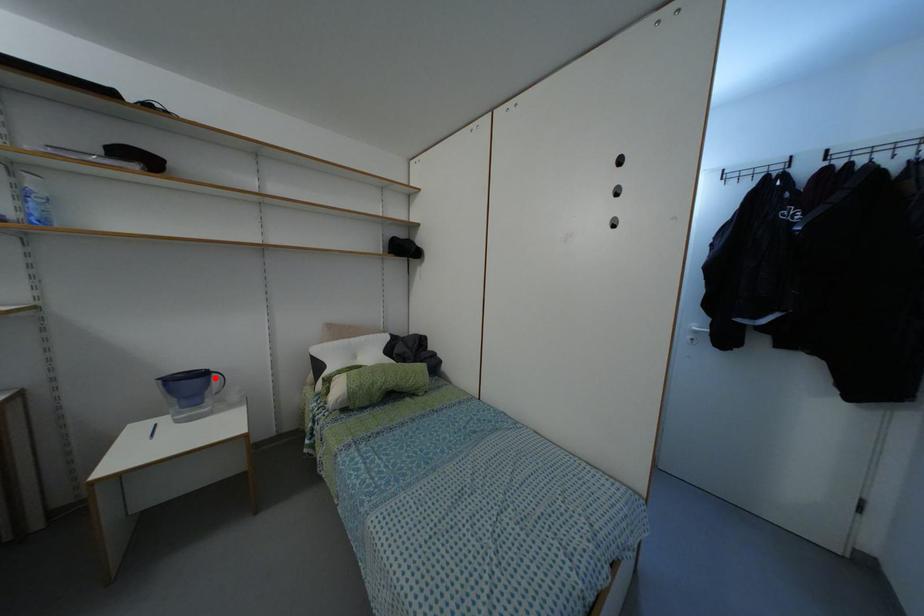
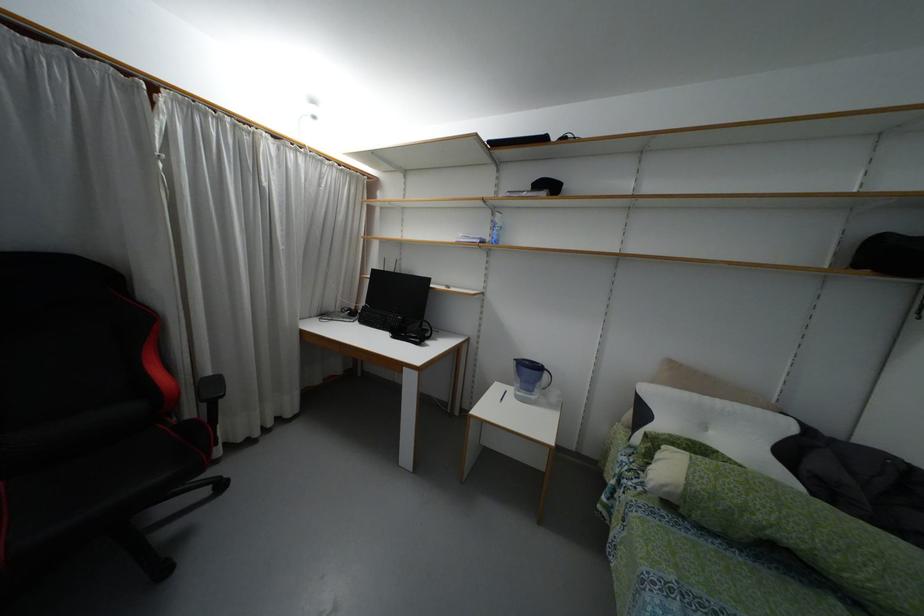
Where in the second image is the point corresponding to the highlighted location from the first image?

(544, 375)